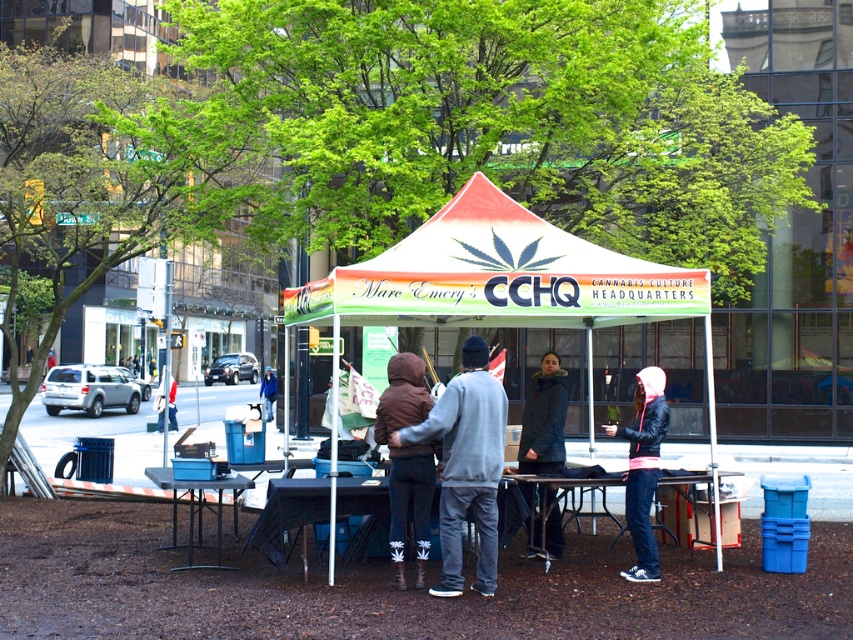
Who is taller, brown fleece jacket at center or pink leather jacket at lower right?

brown fleece jacket at center is taller.

Between brown fleece jacket at center and pink leather jacket at lower right, which one appears on the right side from the viewer's perspective?

pink leather jacket at lower right

Between point (381, 433) and point (641, 483), which one is positioned behind?

Positioned behind is point (641, 483).

The image size is (853, 640). In order to click on brown fleece jacket at center in this screenshot , I will do `click(405, 461)`.

Is matte gray hoodie at center to the left of pink leather jacket at lower right from the viewer's perspective?

Correct, you'll find matte gray hoodie at center to the left of pink leather jacket at lower right.

Between matte gray hoodie at center and pink leather jacket at lower right, which one appears on the left side from the viewer's perspective?

matte gray hoodie at center

Which is in front, point (410, 429) or point (645, 534)?

Point (410, 429) is more forward.

This screenshot has width=853, height=640. Identify the location of matte gray hoodie at center. (466, 465).

Is white fabric tent at center above brown fleece jacket at center?

Indeed, white fabric tent at center is positioned over brown fleece jacket at center.

This screenshot has width=853, height=640. Identify the location of white fabric tent at center. (498, 275).

Between point (392, 248) and point (374, 429), which one is positioned in front?

Point (374, 429) is in front.

Find the location of a particular element. The width and height of the screenshot is (853, 640). white fabric tent at center is located at coordinates (498, 275).